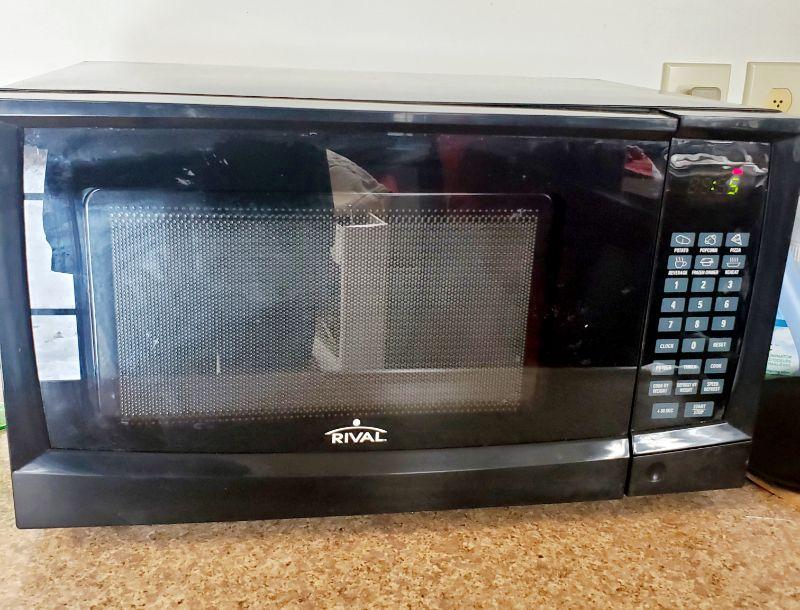
Where is `wall`? This screenshot has height=610, width=800. wall is located at coordinates (590, 35).